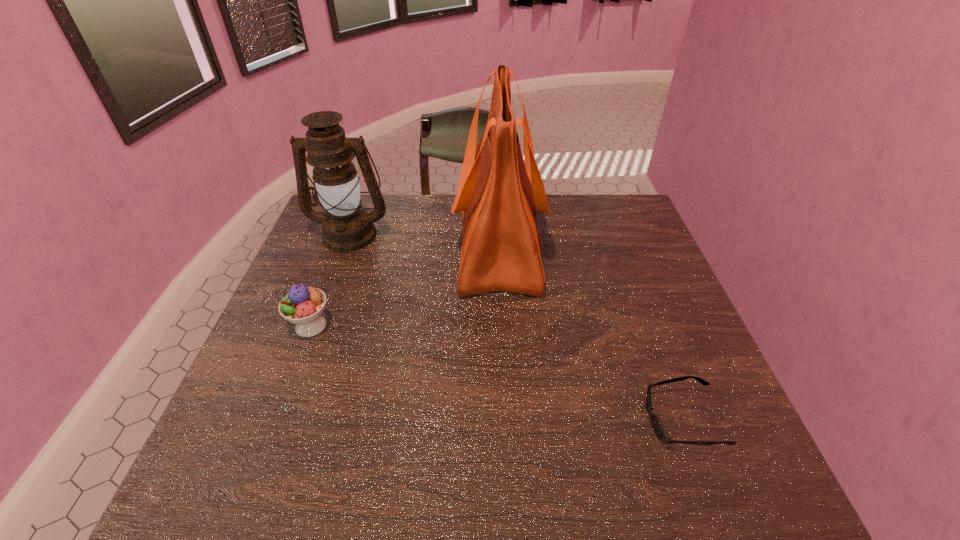
Where is `object that is positioned at the far left corner`? object that is positioned at the far left corner is located at coordinates (346, 228).

The image size is (960, 540). In order to click on vacant space at the far edge in this screenshot , I will do `click(451, 219)`.

Locate an element on the screen. vacant space at the near edge is located at coordinates (351, 467).

The width and height of the screenshot is (960, 540). I want to click on vacant area at the left edge, so click(297, 261).

Where is `vacant space at the right edge of the desktop`? Image resolution: width=960 pixels, height=540 pixels. vacant space at the right edge of the desktop is located at coordinates (704, 403).

The width and height of the screenshot is (960, 540). What are the coordinates of `free space at the near left corner` in the screenshot? It's located at (209, 459).

At what (x,y) coordinates should I click in order to perform the action: click on empty location between the nearest object and the third shortest object. Please return your answer as a coordinate pair (x, y). The width and height of the screenshot is (960, 540). Looking at the image, I should click on (516, 327).

At what (x,y) coordinates should I click in order to perform the action: click on empty space that is in between the sunglasses and the icecream. Please return your answer as a coordinate pair (x, y). This screenshot has height=540, width=960. Looking at the image, I should click on (496, 373).

You are a GUI agent. You are given a task and a screenshot of the screen. Output one action in this format:
    pyautogui.click(x=<x>, y=<y>)
    Task: Click on the empty space that is in between the third shortest object and the tallest object
    
    Given the screenshot: What is the action you would take?
    pyautogui.click(x=424, y=239)

At what (x,y) coordinates should I click in order to perform the action: click on free area in between the second shortest object and the second object from right to left. Please return your answer as a coordinate pair (x, y). The image size is (960, 540). Looking at the image, I should click on (405, 285).